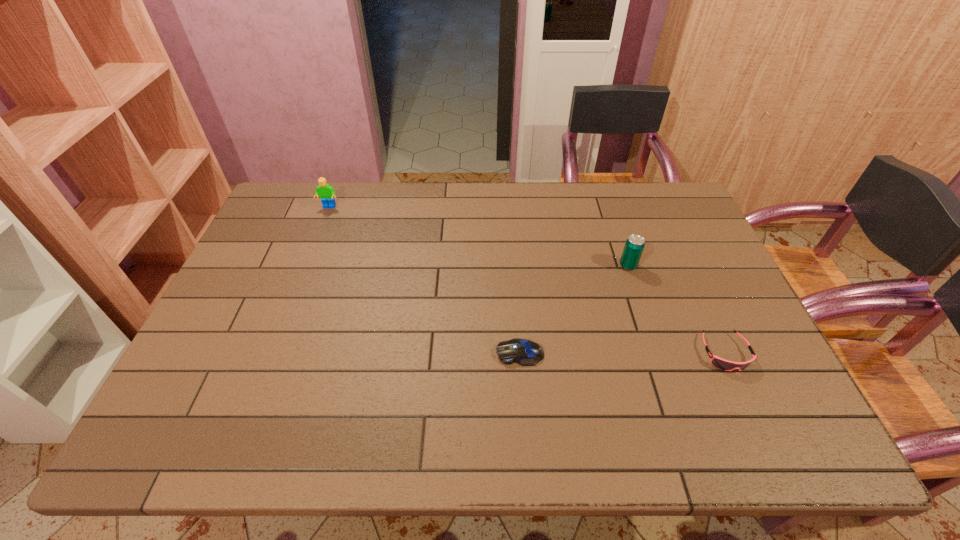
This screenshot has height=540, width=960. In the image, there is a desktop. In order to click on vacant space at the left edge in this screenshot , I will do coord(275,236).

Locate an element on the screen. This screenshot has height=540, width=960. free region at the right edge of the desktop is located at coordinates (689, 239).

Locate an element on the screen. The image size is (960, 540). vacant space at the near right corner of the desktop is located at coordinates (805, 436).

This screenshot has width=960, height=540. Identify the location of vacant area between the second object from left to right and the rightmost object. (622, 353).

The image size is (960, 540). I want to click on free point between the shortest object and the leftmost object, so click(x=424, y=280).

Find the location of a particular element. This screenshot has width=960, height=540. free spot between the second object from left to right and the second farthest object is located at coordinates (574, 309).

The height and width of the screenshot is (540, 960). Identify the location of vacant area that lies between the rightmost object and the second farthest object. (677, 309).

Image resolution: width=960 pixels, height=540 pixels. Identify the location of empty space between the rightmost object and the computer mouse. (622, 353).

Identify the location of vacant area that lies between the beer can and the shortest object. This screenshot has width=960, height=540. (574, 309).

This screenshot has width=960, height=540. I want to click on vacant space in between the goggles and the leftmost object, so click(527, 280).